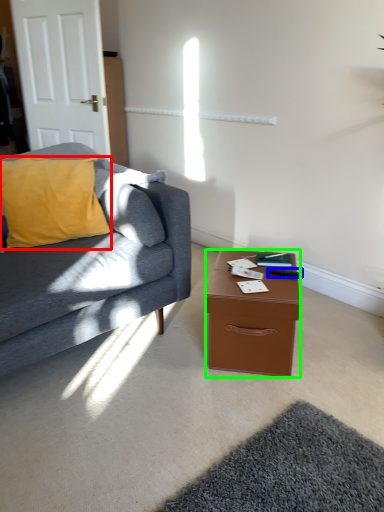
Question: Which object is positioned farthest from pillow (highlighted by a red box)? Select from remote control (highlighted by a blue box) and desk (highlighted by a green box).

Choices:
 (A) remote control
 (B) desk

Answer: (A)